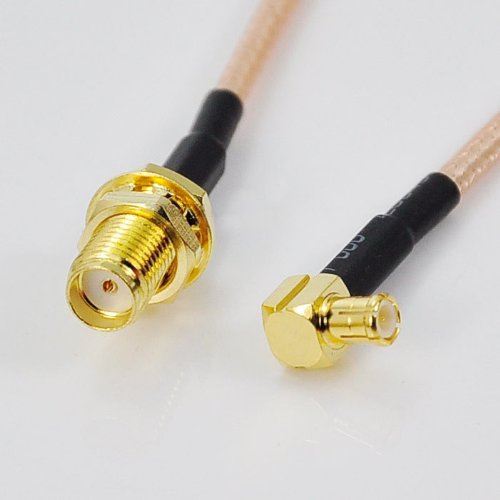
This screenshot has width=500, height=500. Identify the location of tv. (297, 327).